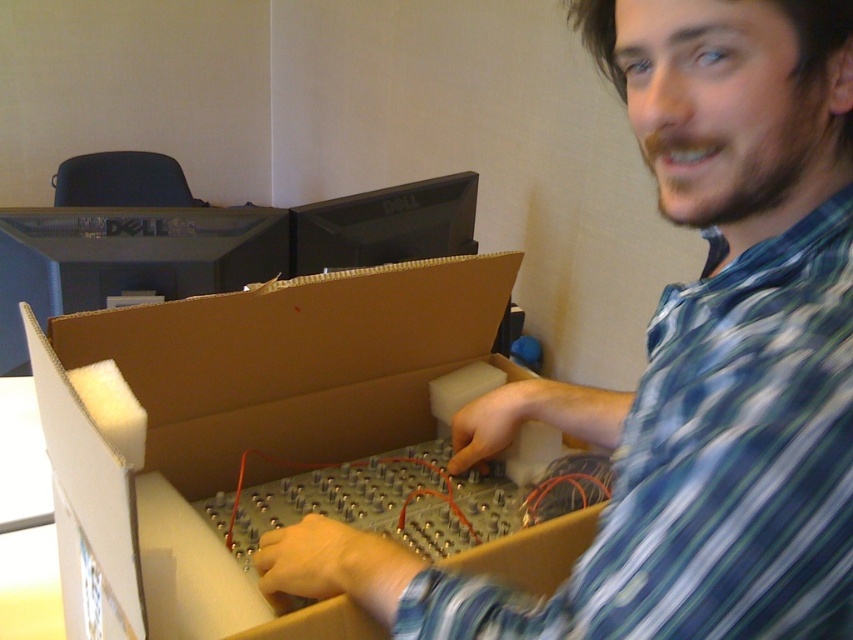
Question: Which of the following is the closest to the observer?

Choices:
 (A) (439, 525)
 (B) (686, 308)

Answer: (B)

Question: Is metallic silver circuit board at center wider than brown cardboard box at center?

Choices:
 (A) yes
 (B) no

Answer: (B)

Question: Does metallic silver circuit board at center have a larger size compared to brown cardboard box at center?

Choices:
 (A) no
 (B) yes

Answer: (A)

Question: Is metallic silver circuit board at center positioned behind brown cardboard box at center?

Choices:
 (A) yes
 (B) no

Answer: (B)